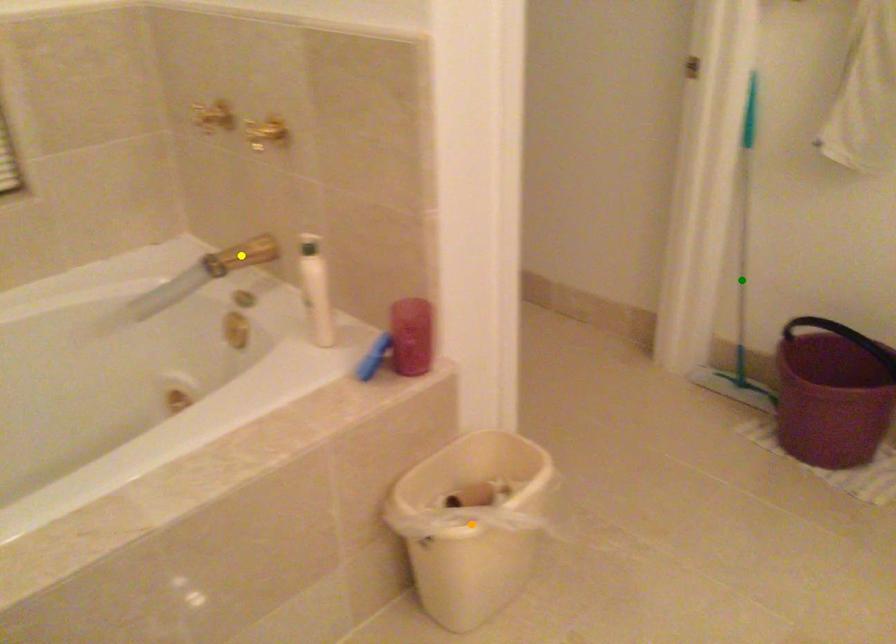
Order these from nearest to farthest:
A) green point
B) yellow point
C) orange point

orange point
yellow point
green point